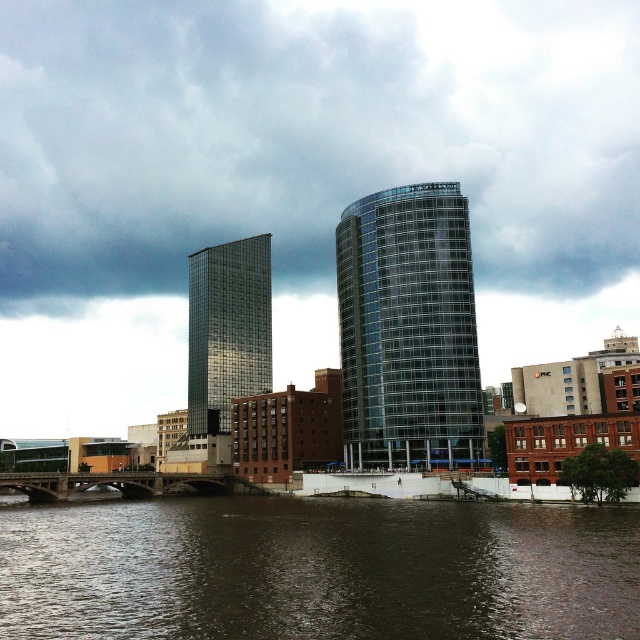
Question: Is the position of cloudy sky at upper center more distant than that of brown water at lower center?

Choices:
 (A) yes
 (B) no

Answer: (A)

Question: Which object is the farthest from the brown water at lower center?

Choices:
 (A) shiny glass skyscraper at center
 (B) transparent glass tower at center
 (C) cloudy sky at upper center

Answer: (C)

Question: Does cloudy sky at upper center appear under shiny glass skyscraper at center?

Choices:
 (A) yes
 (B) no

Answer: (B)

Question: Estimate the real-world distances between objects in this image. Which object is closer to the cloudy sky at upper center?

Choices:
 (A) shiny glass skyscraper at center
 (B) transparent glass tower at center
 (C) brown water at lower center

Answer: (A)

Question: Does transparent glass tower at center have a lesser width compared to shiny glass skyscraper at center?

Choices:
 (A) no
 (B) yes

Answer: (B)

Question: Considering the real-world distances, which object is closest to the cloudy sky at upper center?

Choices:
 (A) shiny glass skyscraper at center
 (B) brown water at lower center

Answer: (A)